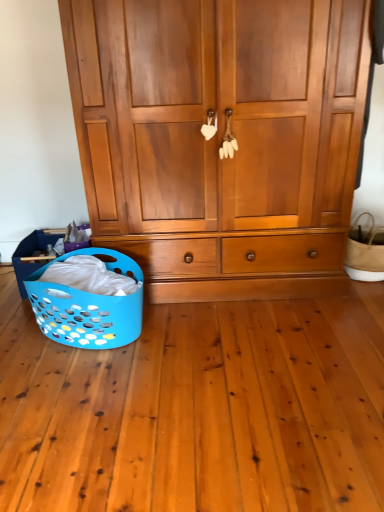
Find the location of a particular element. natural woven basket at right, acting as the second basket starting from the left is located at coordinates (365, 252).

At what (x,y) coordinates should I click in order to perform the action: click on blue plastic laundry basket at lower left, placed as the 2th basket when sorted from right to left. Please return your answer as a coordinate pair (x, y). Looking at the image, I should click on (88, 306).

Measure the distance between blue plastic laundry basket at lower left, placed as the 2th basket when sorted from right to left, and wooden wardrobe at center.

A distance of 67.05 centimeters exists between blue plastic laundry basket at lower left, placed as the 2th basket when sorted from right to left, and wooden wardrobe at center.

Is point (125, 332) positioned in front of point (231, 69)?

No, (125, 332) is further to viewer.

Is blue plastic laundry basket at lower left, the 1th basket when ordered from left to right, completely or partially outside of wooden wardrobe at center?

Absolutely, blue plastic laundry basket at lower left, the 1th basket when ordered from left to right, is external to wooden wardrobe at center.

From a real-world perspective, does natural woven basket at right, acting as the second basket starting from the left, sit lower than blue plastic laundry basket at lower left, placed as the 2th basket when sorted from right to left?

Indeed, from a real-world perspective, natural woven basket at right, acting as the second basket starting from the left, is positioned beneath blue plastic laundry basket at lower left, placed as the 2th basket when sorted from right to left.

Looking at this image, is natural woven basket at right, acting as the second basket starting from the left, positioned with its back to blue plastic laundry basket at lower left, the 1th basket when ordered from left to right?

No, natural woven basket at right, acting as the second basket starting from the left, is not facing the opposite direction of blue plastic laundry basket at lower left, the 1th basket when ordered from left to right.

Is natural woven basket at right, acting as the second basket starting from the left, next to blue plastic laundry basket at lower left, the 1th basket when ordered from left to right, and touching it?

No, natural woven basket at right, acting as the second basket starting from the left, is not in contact with blue plastic laundry basket at lower left, the 1th basket when ordered from left to right.

Looking at this image, between wooden wardrobe at center and natural woven basket at right, arranged as the 1th basket when viewed from the right, which one has larger size?

wooden wardrobe at center.

Which of these two, wooden wardrobe at center or natural woven basket at right, arranged as the 1th basket when viewed from the right, is thinner?

With smaller width is natural woven basket at right, arranged as the 1th basket when viewed from the right.

Is wooden wardrobe at center positioned before natural woven basket at right, acting as the second basket starting from the left?

Yes, it is in front of natural woven basket at right, acting as the second basket starting from the left.

How different are the orientations of wooden wardrobe at center and blue plastic laundry basket at lower left, placed as the 2th basket when sorted from right to left, in degrees?

wooden wardrobe at center and blue plastic laundry basket at lower left, placed as the 2th basket when sorted from right to left, are facing 49.8 degrees away from each other.

Is blue plastic laundry basket at lower left, placed as the 2th basket when sorted from right to left, surrounded by wooden wardrobe at center?

Actually, blue plastic laundry basket at lower left, placed as the 2th basket when sorted from right to left, is outside wooden wardrobe at center.

Does wooden wardrobe at center appear on the right side of blue plastic laundry basket at lower left, the 1th basket when ordered from left to right?

Yes.

Is wooden wardrobe at center aimed at blue plastic laundry basket at lower left, placed as the 2th basket when sorted from right to left?

Yes.

From a real-world perspective, is natural woven basket at right, arranged as the 1th basket when viewed from the right, on wooden wardrobe at center?

No, from a real-world perspective, natural woven basket at right, arranged as the 1th basket when viewed from the right, is not on top of wooden wardrobe at center.

Is natural woven basket at right, acting as the second basket starting from the left, facing away from wooden wardrobe at center?

That's not correct — natural woven basket at right, acting as the second basket starting from the left, is not looking away from wooden wardrobe at center.

Is natural woven basket at right, arranged as the 1th basket when viewed from the right, in contact with wooden wardrobe at center?

No, natural woven basket at right, arranged as the 1th basket when viewed from the right, is not making contact with wooden wardrobe at center.

Is natural woven basket at right, acting as the second basket starting from the left, completely or partially outside of wooden wardrobe at center?

Absolutely, natural woven basket at right, acting as the second basket starting from the left, is external to wooden wardrobe at center.

How different are the orientations of blue plastic laundry basket at lower left, placed as the 2th basket when sorted from right to left, and natural woven basket at right, acting as the second basket starting from the left, in degrees?

There is a 49.6-degree angle between the facing directions of blue plastic laundry basket at lower left, placed as the 2th basket when sorted from right to left, and natural woven basket at right, acting as the second basket starting from the left.

Is blue plastic laundry basket at lower left, the 1th basket when ordered from left to right, surrounding natural woven basket at right, arranged as the 1th basket when viewed from the right?

That's incorrect, natural woven basket at right, arranged as the 1th basket when viewed from the right, is not inside blue plastic laundry basket at lower left, the 1th basket when ordered from left to right.

Which point is more distant from viewer, (91,298) or (375,240)?

Point (375,240)

Is blue plastic laundry basket at lower left, the 1th basket when ordered from left to right, far away from natural woven basket at right, acting as the second basket starting from the left?

Indeed, blue plastic laundry basket at lower left, the 1th basket when ordered from left to right, is not near natural woven basket at right, acting as the second basket starting from the left.

The image size is (384, 512). Identify the location of basket on the left of wooden wardrobe at center. (88, 306).

Where is `basket above the blue plastic laundry basket at lower left, placed as the 2th basket when sorted from right to left (from the image's perspective)`? basket above the blue plastic laundry basket at lower left, placed as the 2th basket when sorted from right to left (from the image's perspective) is located at coordinates (365, 252).

When comparing their distances from natural woven basket at right, arranged as the 1th basket when viewed from the right, does wooden wardrobe at center or blue plastic laundry basket at lower left, placed as the 2th basket when sorted from right to left, seem closer?

Based on the image, wooden wardrobe at center appears to be nearer to natural woven basket at right, arranged as the 1th basket when viewed from the right.

Consider the image. When comparing their distances from natural woven basket at right, acting as the second basket starting from the left, does blue plastic laundry basket at lower left, placed as the 2th basket when sorted from right to left, or wooden wardrobe at center seem further?

Among the two, blue plastic laundry basket at lower left, placed as the 2th basket when sorted from right to left, is located further to natural woven basket at right, acting as the second basket starting from the left.

Considering their positions, is natural woven basket at right, arranged as the 1th basket when viewed from the right, positioned further to blue plastic laundry basket at lower left, the 1th basket when ordered from left to right, than wooden wardrobe at center?

The object further to blue plastic laundry basket at lower left, the 1th basket when ordered from left to right, is natural woven basket at right, arranged as the 1th basket when viewed from the right.

From the picture: Considering their positions, is blue plastic laundry basket at lower left, placed as the 2th basket when sorted from right to left, positioned further to wooden wardrobe at center than natural woven basket at right, arranged as the 1th basket when viewed from the right?

Based on the image, natural woven basket at right, arranged as the 1th basket when viewed from the right, appears to be further to wooden wardrobe at center.

Looking at the image, which one is located further to blue plastic laundry basket at lower left, placed as the 2th basket when sorted from right to left, wooden wardrobe at center or natural woven basket at right, acting as the second basket starting from the left?

natural woven basket at right, acting as the second basket starting from the left, lies further to blue plastic laundry basket at lower left, placed as the 2th basket when sorted from right to left, than the other object.

Based on the photo, when comparing their distances from wooden wardrobe at center, does natural woven basket at right, arranged as the 1th basket when viewed from the right, or blue plastic laundry basket at lower left, the 1th basket when ordered from left to right, seem further?

natural woven basket at right, arranged as the 1th basket when viewed from the right, is further to wooden wardrobe at center.

Find the location of a particular element. This screenshot has width=384, height=512. cupboard between blue plastic laundry basket at lower left, placed as the 2th basket when sorted from right to left, and natural woven basket at right, arranged as the 1th basket when viewed from the right is located at coordinates (221, 138).